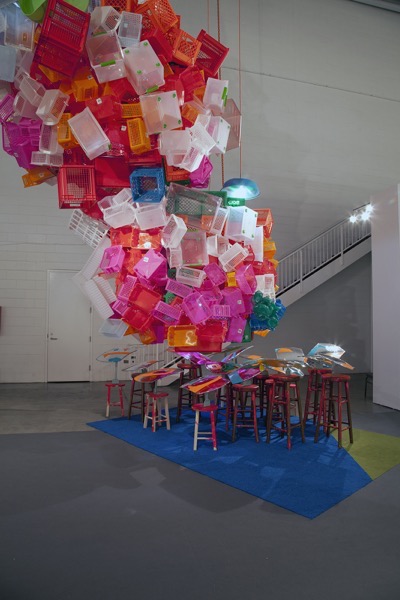
The image size is (400, 600). I want to click on light, so click(364, 216), click(352, 219), click(368, 208).